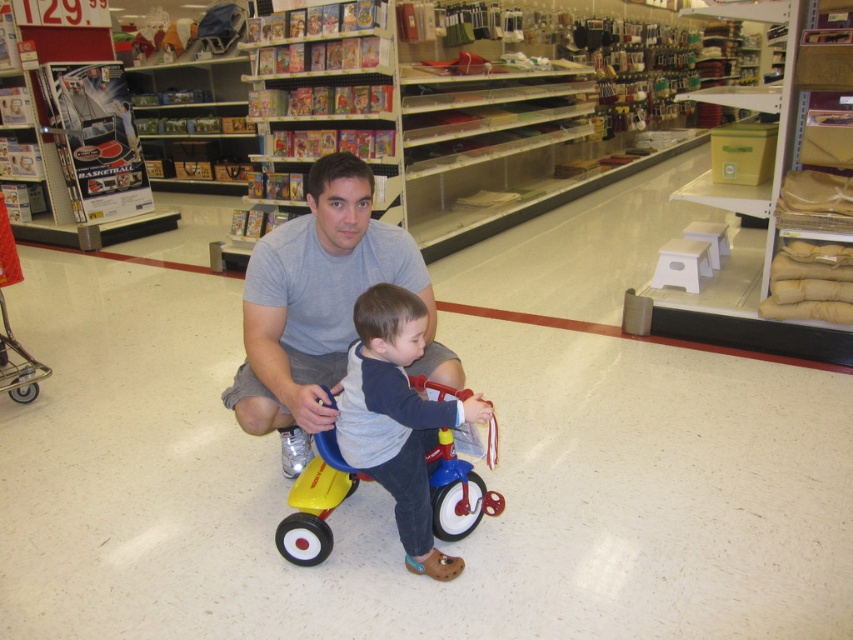
The image size is (853, 640). What are the coordinates of `gray cotton shirt at center` in the screenshot? It's located at (320, 307).

The height and width of the screenshot is (640, 853). What do you see at coordinates (320, 307) in the screenshot? I see `gray cotton shirt at center` at bounding box center [320, 307].

Identify the location of gray cotton shirt at center. Image resolution: width=853 pixels, height=640 pixels. (320, 307).

Does gray fleece shirt at center have a lesser height compared to metallic silver shopping cart at lower left?

Yes, gray fleece shirt at center is shorter than metallic silver shopping cart at lower left.

Does gray fleece shirt at center come behind metallic silver shopping cart at lower left?

That is False.

Who is more forward, (375, 310) or (1, 248)?

Point (375, 310)

Locate an element on the screen. gray fleece shirt at center is located at coordinates (397, 419).

Does gray cotton shirt at center have a smaller size compared to metallic silver shopping cart at lower left?

Correct, gray cotton shirt at center occupies less space than metallic silver shopping cart at lower left.

Is gray cotton shirt at center bigger than metallic silver shopping cart at lower left?

No.

Locate an element on the screen. This screenshot has width=853, height=640. gray cotton shirt at center is located at coordinates [x=320, y=307].